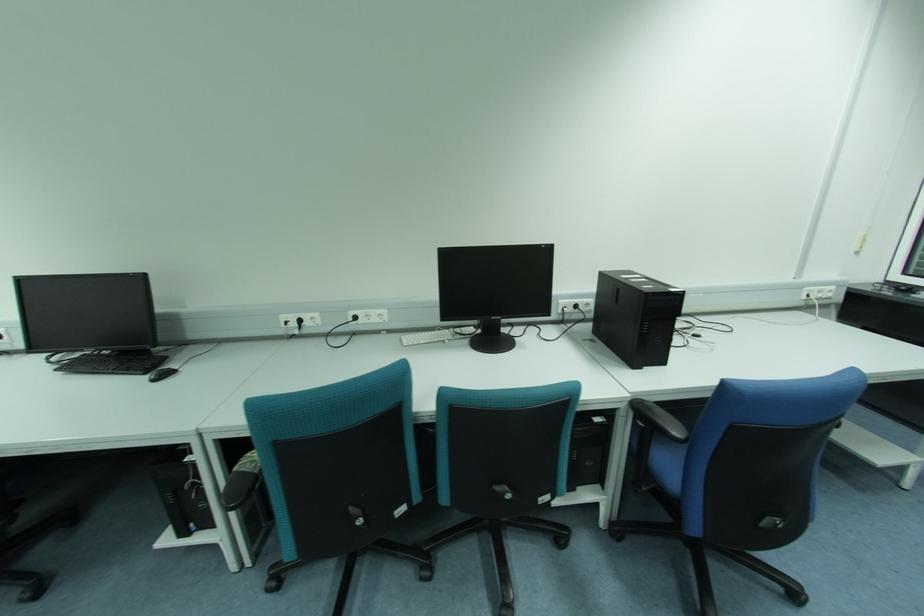
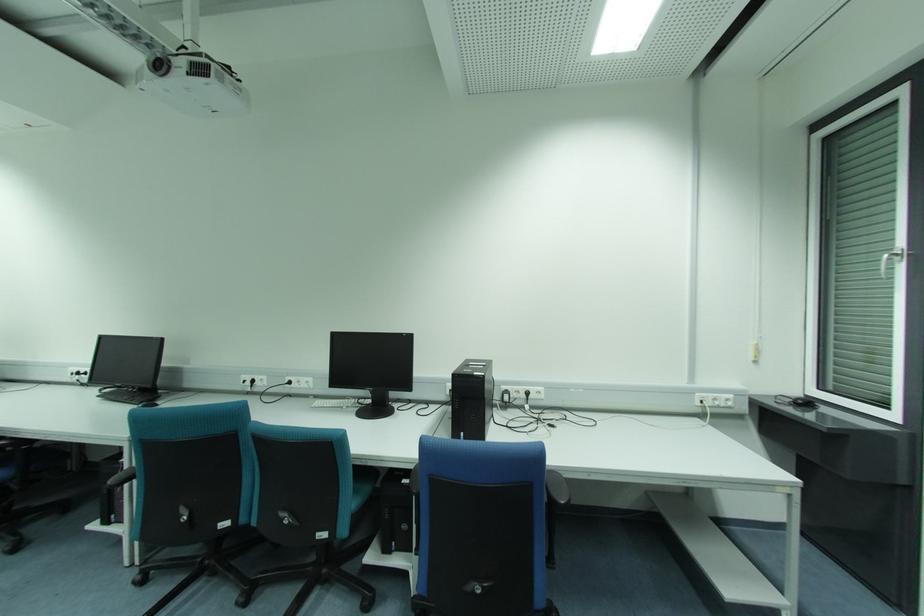
Where in the second image is the point corresponding to (58,370) from the first image?

(100, 397)